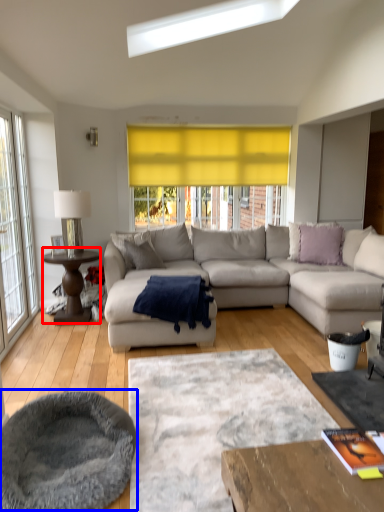
Question: Which of the following is the farthest to the observer, coffee table (highlighted by a red box) or cat bed (highlighted by a blue box)?

Choices:
 (A) coffee table
 (B) cat bed

Answer: (A)